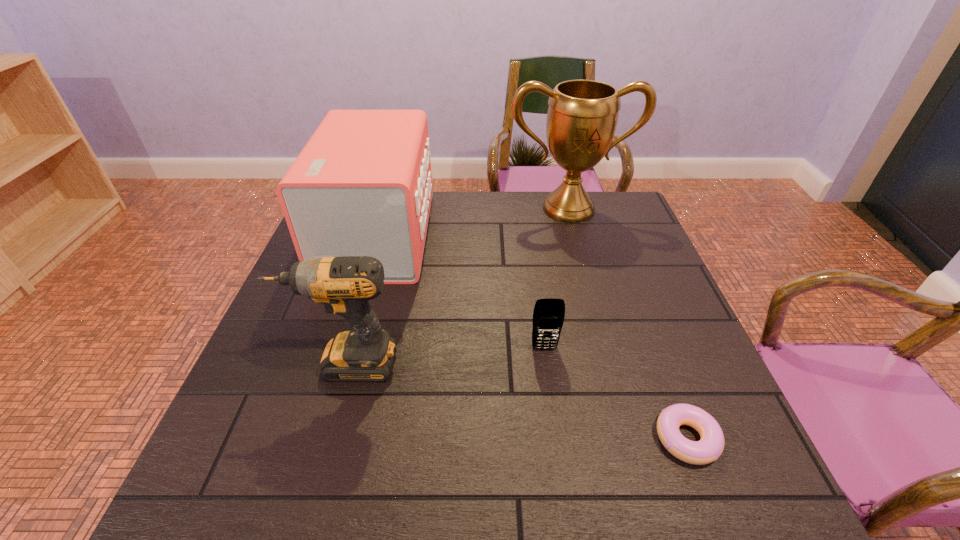
What are the coordinates of `free space in the image that satisfies the following two spatial constraints: 1. on the surface of the box where the text is embossed; 2. on the right side of the doughnut` in the screenshot? It's located at (318, 438).